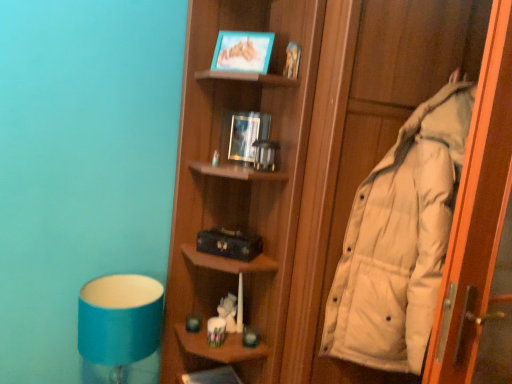
Question: Is white down jacket at right to the left or to the right of wooden shelf at lower center in the image?

Choices:
 (A) left
 (B) right

Answer: (B)

Question: From a real-world perspective, is white down jacket at right above or below wooden shelf at lower center?

Choices:
 (A) below
 (B) above

Answer: (B)

Question: Which object is the closest to the blue fabric lampshade at lower left?

Choices:
 (A) wooden shelf at lower center
 (B) white down jacket at right
 (C) white down jacket at right

Answer: (A)

Question: Estimate the real-world distances between objects in this image. Which object is farther from the white down jacket at right?

Choices:
 (A) wooden shelf at lower center
 (B) blue fabric lampshade at lower left
 (C) white down jacket at right

Answer: (A)